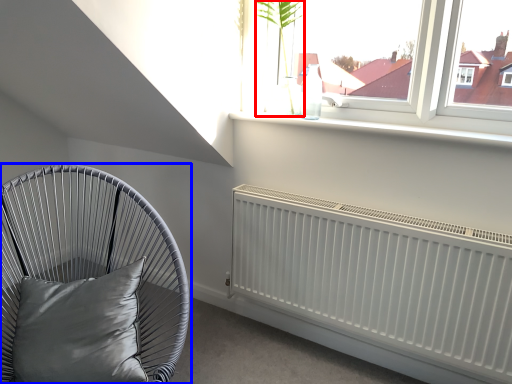
Question: Which of the following is the closest to the observer, plant (highlighted by a red box) or furniture (highlighted by a blue box)?

Choices:
 (A) plant
 (B) furniture

Answer: (B)